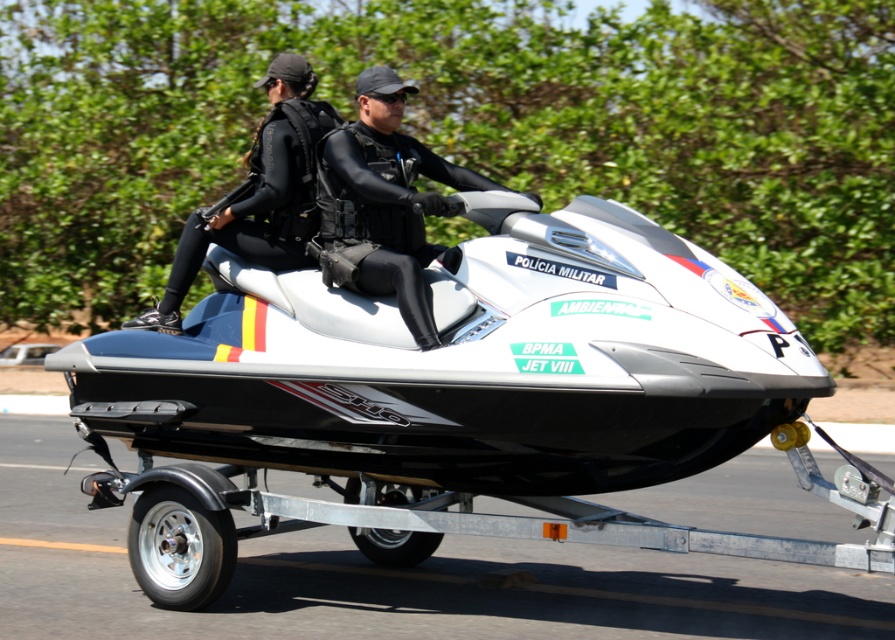
You are a photographer trying to capture both riders wearing black matte wetsuit at center and black matte wetsuit at left. Since you want to ensure both are in focus, which rider should you adjust your camera focus on first to account for their size difference?

The black matte wetsuit at center is larger in size than black matte wetsuit at left. Therefore, you should focus on the black matte wetsuit at center first because it is closer to the camera, ensuring both will be in focus when using depth of field appropriately.

You are a safety officer on the jet ski and need to ensure the riders are spaced properly. Given that the recommended minimum distance between riders on a jet ski is 12 inches, is the current spacing between the black matte wetsuit at center and the black matte wetsuit at left sufficient?

The distance between the black matte wetsuit at center and the black matte wetsuit at left is 14.91 inches, which exceeds the recommended minimum of 12 inches. Therefore, the current spacing is sufficient.

From the picture: You are a photographer trying to capture a clear photo of the white matte jet ski at center and the black matte wetsuit at left. Since you want the jet ski to be the main focus, which object should you adjust your camera to focus on first?

The white matte jet ski at center is closer to the viewer than the black matte wetsuit at left, so you should focus on the white matte jet ski at center first to ensure it is sharp and in focus.